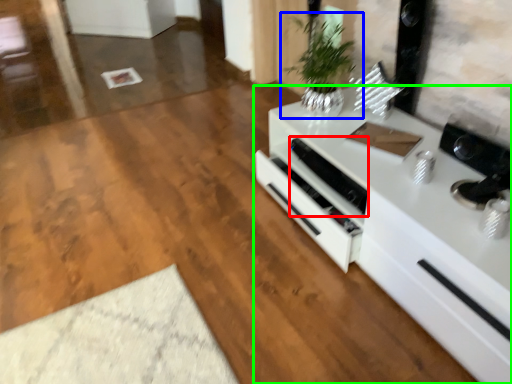
Question: Which object is positioned farthest from appliance (highlighted by a red box)? Select from houseplant (highlighted by a blue box) and countertop (highlighted by a green box).

Choices:
 (A) houseplant
 (B) countertop

Answer: (A)